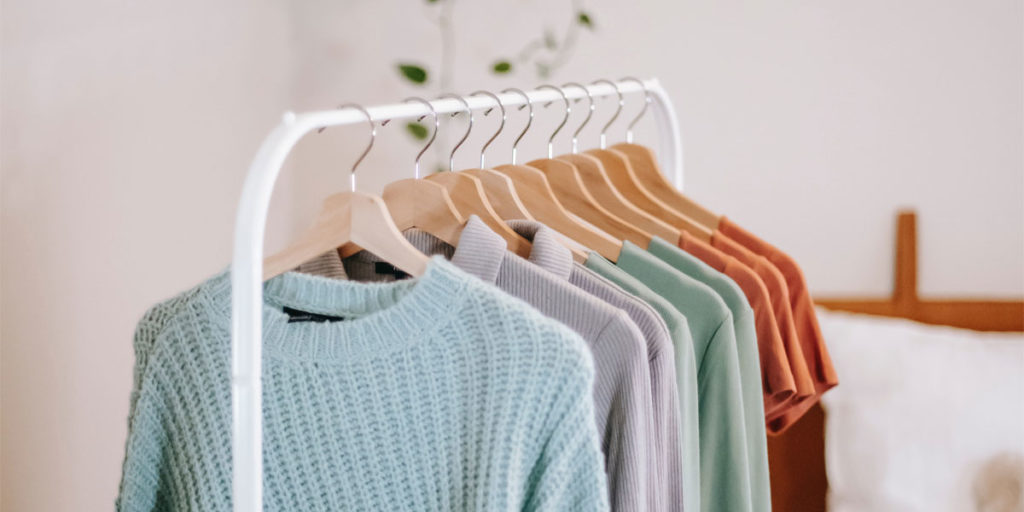
You are a GUI agent. You are given a task and a screenshot of the screen. Output one action in this format:
    pyautogui.click(x=<x>, y=<y>)
    Task: Click on the hangers
    The height and width of the screenshot is (512, 1024).
    Given the screenshot: What is the action you would take?
    pyautogui.click(x=374, y=230), pyautogui.click(x=419, y=192), pyautogui.click(x=465, y=190), pyautogui.click(x=502, y=198), pyautogui.click(x=538, y=198), pyautogui.click(x=567, y=189), pyautogui.click(x=595, y=183), pyautogui.click(x=613, y=176), pyautogui.click(x=642, y=170)